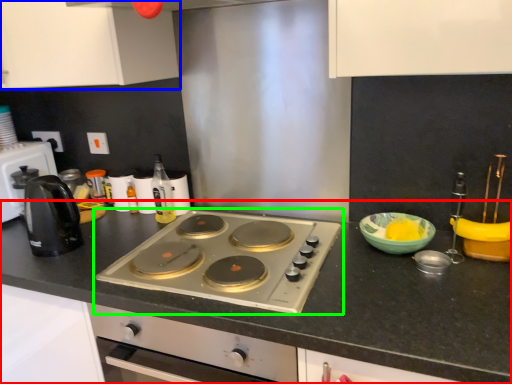
Question: Which object is the farthest from countertop (highlighted by a red box)? Choose among these: cabinetry (highlighted by a blue box) or gas stove (highlighted by a green box).

Choices:
 (A) cabinetry
 (B) gas stove

Answer: (A)